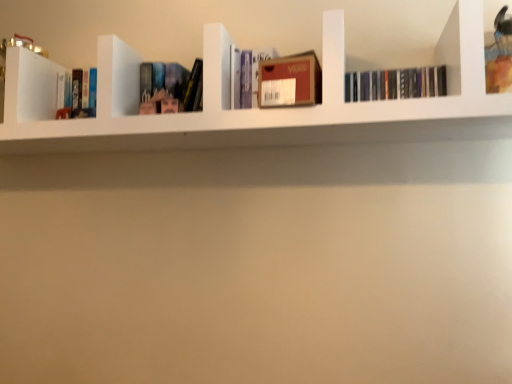
Locate an element on the screen. matte plastic book at center, which ranks as the 4th book in right-to-left order is located at coordinates (175, 90).

Locate an element on the screen. Image resolution: width=512 pixels, height=384 pixels. matte cardboard box at center, acting as the 3th book starting from the right is located at coordinates (246, 75).

Identify the location of hardcover book at left, the 5th book when ordered from right to left. This screenshot has width=512, height=384. click(77, 94).

The height and width of the screenshot is (384, 512). What do you see at coordinates (290, 81) in the screenshot?
I see `brown cardboard box at center, which ranks as the second book in right-to-left order` at bounding box center [290, 81].

Locate an element on the screen. The image size is (512, 384). white matte bookshelf at upper center is located at coordinates (271, 127).

Looking at their sizes, would you say white matte bookshelf at upper center is wider or thinner than matte plastic book at center, the 2th book positioned from the left?

In the image, white matte bookshelf at upper center appears to be wider than matte plastic book at center, the 2th book positioned from the left.

Between white matte bookshelf at upper center and matte plastic book at center, which ranks as the 4th book in right-to-left order, which one is positioned behind?

matte plastic book at center, which ranks as the 4th book in right-to-left order, is more distant.

Is white matte bookshelf at upper center positioned with its back to matte plastic book at center, the 2th book positioned from the left?

Yes, matte plastic book at center, the 2th book positioned from the left, is at the back of white matte bookshelf at upper center.

Does matte cardboard box at center, the third book when ordered from left to right, come behind black matte books at upper right, the 5th book in the left-to-right sequence?

Yes.

From the picture: Would you say matte cardboard box at center, the third book when ordered from left to right, is outside black matte books at upper right, which ranks as the first book in right-to-left order?

Yes, matte cardboard box at center, the third book when ordered from left to right, is not within black matte books at upper right, which ranks as the first book in right-to-left order.

Is matte cardboard box at center, the third book when ordered from left to right, at the left side of black matte books at upper right, the 5th book in the left-to-right sequence?

Yes.

From a real-world perspective, relative to black matte books at upper right, which ranks as the first book in right-to-left order, is matte cardboard box at center, the third book when ordered from left to right, vertically above or below?

matte cardboard box at center, the third book when ordered from left to right, is above black matte books at upper right, which ranks as the first book in right-to-left order.

In the scene shown: Are black matte books at upper right, the 5th book in the left-to-right sequence, and hardcover book at left, which is the 1th book from left to right, far apart?

No.

Between black matte books at upper right, which ranks as the first book in right-to-left order, and hardcover book at left, the 5th book when ordered from right to left, which one appears on the right side from the viewer's perspective?

black matte books at upper right, which ranks as the first book in right-to-left order, is more to the right.

Is black matte books at upper right, which ranks as the first book in right-to-left order, inside or outside of hardcover book at left, the 5th book when ordered from right to left?

black matte books at upper right, which ranks as the first book in right-to-left order, exists outside the volume of hardcover book at left, the 5th book when ordered from right to left.

Does black matte books at upper right, the 5th book in the left-to-right sequence, have a smaller size compared to hardcover book at left, the 5th book when ordered from right to left?

Yes, black matte books at upper right, the 5th book in the left-to-right sequence, is smaller than hardcover book at left, the 5th book when ordered from right to left.

Considering the relative positions of matte plastic book at center, the 2th book positioned from the left, and matte cardboard box at center, acting as the 3th book starting from the right, in the image provided, is matte plastic book at center, the 2th book positioned from the left, to the left of matte cardboard box at center, acting as the 3th book starting from the right, from the viewer's perspective?

Correct, you'll find matte plastic book at center, the 2th book positioned from the left, to the left of matte cardboard box at center, acting as the 3th book starting from the right.

Is matte plastic book at center, which ranks as the 4th book in right-to-left order, closer to the viewer compared to matte cardboard box at center, the third book when ordered from left to right?

No, the depth of matte plastic book at center, which ranks as the 4th book in right-to-left order, is greater than that of matte cardboard box at center, the third book when ordered from left to right.

Locate an element on the screen. The width and height of the screenshot is (512, 384). the 1st book above the matte plastic book at center, which ranks as the 4th book in right-to-left order (from a real-world perspective) is located at coordinates (246, 75).

How much distance is there between matte plastic book at center, the 2th book positioned from the left, and matte cardboard box at center, the third book when ordered from left to right?

matte plastic book at center, the 2th book positioned from the left, is 7.10 inches away from matte cardboard box at center, the third book when ordered from left to right.

Based on the photo, between hardcover book at left, which is the 1th book from left to right, and matte cardboard box at center, the third book when ordered from left to right, which one has smaller width?

hardcover book at left, which is the 1th book from left to right, is thinner.

Considering the relative positions of hardcover book at left, which is the 1th book from left to right, and matte cardboard box at center, acting as the 3th book starting from the right, in the image provided, is hardcover book at left, which is the 1th book from left to right, to the left of matte cardboard box at center, acting as the 3th book starting from the right, from the viewer's perspective?

Yes, hardcover book at left, which is the 1th book from left to right, is to the left of matte cardboard box at center, acting as the 3th book starting from the right.

What's the angular difference between hardcover book at left, which is the 1th book from left to right, and matte cardboard box at center, the third book when ordered from left to right,'s facing directions?

They differ by 3.45 degrees in their facing directions.

Is hardcover book at left, the 5th book when ordered from right to left, behind matte cardboard box at center, acting as the 3th book starting from the right?

Yes, it is.

Which is more to the right, matte plastic book at center, which ranks as the 4th book in right-to-left order, or black matte books at upper right, which ranks as the first book in right-to-left order?

black matte books at upper right, which ranks as the first book in right-to-left order.

From the picture: Is matte plastic book at center, the 2th book positioned from the left, positioned behind black matte books at upper right, the 5th book in the left-to-right sequence?

Yes, matte plastic book at center, the 2th book positioned from the left, is behind black matte books at upper right, the 5th book in the left-to-right sequence.

Identify the location of book that is the 3rd one when counting rightward from the matte plastic book at center, the 2th book positioned from the left. The image size is (512, 384). (395, 84).

Looking at their sizes, would you say matte plastic book at center, which ranks as the 4th book in right-to-left order, is wider or thinner than black matte books at upper right, the 5th book in the left-to-right sequence?

In the image, matte plastic book at center, which ranks as the 4th book in right-to-left order, appears to be wider than black matte books at upper right, the 5th book in the left-to-right sequence.

In terms of width, does white matte bookshelf at upper center look wider or thinner when compared to black matte books at upper right, the 5th book in the left-to-right sequence?

In the image, white matte bookshelf at upper center appears to be wider than black matte books at upper right, the 5th book in the left-to-right sequence.

Is white matte bookshelf at upper center further to camera compared to black matte books at upper right, the 5th book in the left-to-right sequence?

That is False.

Are white matte bookshelf at upper center and black matte books at upper right, the 5th book in the left-to-right sequence, far apart?

white matte bookshelf at upper center is actually quite close to black matte books at upper right, the 5th book in the left-to-right sequence.

From the image's perspective, is white matte bookshelf at upper center on top of black matte books at upper right, which ranks as the first book in right-to-left order?

No.

Locate an element on the screen. shelf located underneath the matte plastic book at center, which ranks as the 4th book in right-to-left order (from a real-world perspective) is located at coordinates (271, 127).

Locate an element on the screen. Image resolution: width=512 pixels, height=384 pixels. book that is the 1st object located above the black matte books at upper right, which ranks as the first book in right-to-left order (from the image's perspective) is located at coordinates (246, 75).

Considering their positions, is matte cardboard box at center, the third book when ordered from left to right, positioned further to matte plastic book at center, which ranks as the 4th book in right-to-left order, than brown cardboard box at center, which ranks as the second book in right-to-left order?

brown cardboard box at center, which ranks as the second book in right-to-left order.

From the image, which object appears to be farther from brown cardboard box at center, placed as the 4th book when sorted from left to right, black matte books at upper right, the 5th book in the left-to-right sequence, or matte cardboard box at center, acting as the 3th book starting from the right?

Based on the image, black matte books at upper right, the 5th book in the left-to-right sequence, appears to be further to brown cardboard box at center, placed as the 4th book when sorted from left to right.

In the scene shown: Based on their spatial positions, is white matte bookshelf at upper center or matte cardboard box at center, acting as the 3th book starting from the right, closer to matte plastic book at center, which ranks as the 4th book in right-to-left order?

The object closer to matte plastic book at center, which ranks as the 4th book in right-to-left order, is matte cardboard box at center, acting as the 3th book starting from the right.

Estimate the real-world distances between objects in this image. Which object is closer to brown cardboard box at center, placed as the 4th book when sorted from left to right, hardcover book at left, the 5th book when ordered from right to left, or white matte bookshelf at upper center?

Based on the image, white matte bookshelf at upper center appears to be nearer to brown cardboard box at center, placed as the 4th book when sorted from left to right.

When comparing their distances from hardcover book at left, the 5th book when ordered from right to left, does brown cardboard box at center, placed as the 4th book when sorted from left to right, or matte plastic book at center, which ranks as the 4th book in right-to-left order, seem closer?

matte plastic book at center, which ranks as the 4th book in right-to-left order.

Considering their positions, is matte plastic book at center, the 2th book positioned from the left, positioned closer to hardcover book at left, the 5th book when ordered from right to left, than matte cardboard box at center, the third book when ordered from left to right?

Among the two, matte plastic book at center, the 2th book positioned from the left, is located nearer to hardcover book at left, the 5th book when ordered from right to left.

Based on their spatial positions, is matte cardboard box at center, the third book when ordered from left to right, or white matte bookshelf at upper center further from black matte books at upper right, which ranks as the first book in right-to-left order?

matte cardboard box at center, the third book when ordered from left to right, is positioned further to the anchor black matte books at upper right, which ranks as the first book in right-to-left order.

Based on their spatial positions, is white matte bookshelf at upper center or hardcover book at left, the 5th book when ordered from right to left, further from matte cardboard box at center, the third book when ordered from left to right?

Among the two, hardcover book at left, the 5th book when ordered from right to left, is located further to matte cardboard box at center, the third book when ordered from left to right.

At what (x,y) coordinates should I click in order to perform the action: click on book between matte cardboard box at center, acting as the 3th book starting from the right, and black matte books at upper right, the 5th book in the left-to-right sequence, in the horizontal direction. Please return your answer as a coordinate pair (x, y). The image size is (512, 384). Looking at the image, I should click on (290, 81).

This screenshot has height=384, width=512. Identify the location of shelf located between hardcover book at left, which is the 1th book from left to right, and black matte books at upper right, the 5th book in the left-to-right sequence, in the left-right direction. (271, 127).

What are the coordinates of `shelf located between hardcover book at left, which is the 1th book from left to right, and brown cardboard box at center, which ranks as the second book in right-to-left order, in the left-right direction` in the screenshot? It's located at (271, 127).

This screenshot has width=512, height=384. I want to click on shelf located between matte plastic book at center, the 2th book positioned from the left, and black matte books at upper right, the 5th book in the left-to-right sequence, in the left-right direction, so click(x=271, y=127).